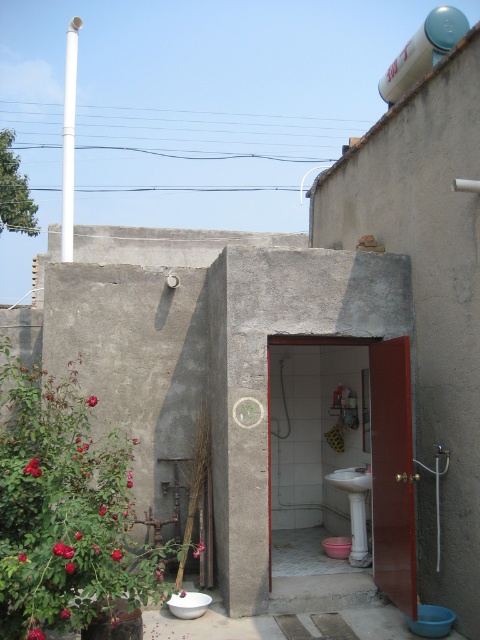
Is matte concrete door at center above white glossy toilet bowl at lower center?

Yes, matte concrete door at center is above white glossy toilet bowl at lower center.

Does matte concrete door at center have a lesser width compared to white glossy toilet bowl at lower center?

Correct, matte concrete door at center's width is less than white glossy toilet bowl at lower center's.

Locate an element on the screen. The height and width of the screenshot is (640, 480). matte concrete door at center is located at coordinates (429, 291).

Is matte concrete door at center to the left of white glossy water tank at upper right from the viewer's perspective?

Yes, matte concrete door at center is to the left of white glossy water tank at upper right.

Image resolution: width=480 pixels, height=640 pixels. Describe the element at coordinates (429, 291) in the screenshot. I see `matte concrete door at center` at that location.

Which is in front, point (469, 499) or point (435, 19)?

Point (469, 499)

Identify the location of matte concrete door at center. This screenshot has height=640, width=480. (429, 291).

Which is in front, point (365, 554) or point (200, 595)?

Point (200, 595) is more forward.

Who is positioned more to the left, white glossy sink at center or white glossy toilet bowl at center?

white glossy toilet bowl at center

Measure the distance between point (x=358, y=522) and camera.

They are 6.75 meters apart.

Where is `white glossy sink at center`? This screenshot has height=640, width=480. white glossy sink at center is located at coordinates (355, 509).